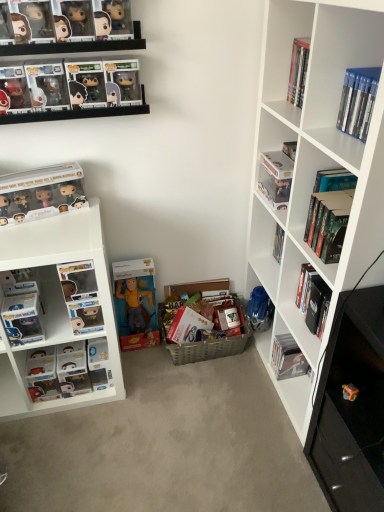
The width and height of the screenshot is (384, 512). Find the location of `vacant space to the right of matte plastic pop vinyl figure at lower left, placed as the 7th book when sorted from right to left`. vacant space to the right of matte plastic pop vinyl figure at lower left, placed as the 7th book when sorted from right to left is located at coordinates (144, 379).